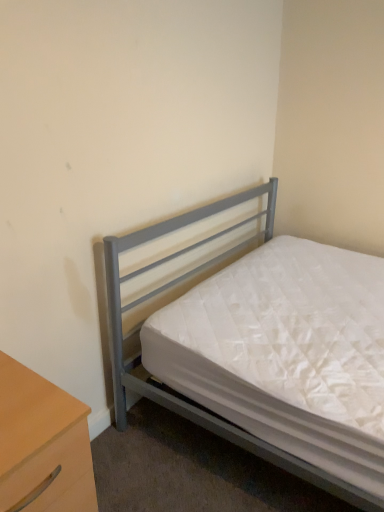
The width and height of the screenshot is (384, 512). Identify the location of metallic gray bed at center. (169, 392).

Measure the distance between metallic gray bed at center and camera.

A distance of 4.08 feet exists between metallic gray bed at center and camera.

The image size is (384, 512). What do you see at coordinates (169, 392) in the screenshot?
I see `metallic gray bed at center` at bounding box center [169, 392].

What do you see at coordinates (42, 444) in the screenshot? Image resolution: width=384 pixels, height=512 pixels. I see `light wood/wooden nightstand at lower left` at bounding box center [42, 444].

The height and width of the screenshot is (512, 384). Identify the location of light wood/wooden nightstand at lower left. (42, 444).

You are a GUI agent. You are given a task and a screenshot of the screen. Output one action in this format:
    pyautogui.click(x=<x>, y=<y>)
    Task: Click on the metallic gray bed at center
    
    Given the screenshot: What is the action you would take?
    pyautogui.click(x=169, y=392)

Between metallic gray bed at center and light wood/wooden nightstand at lower left, which one appears on the left side from the viewer's perspective?

Positioned to the left is light wood/wooden nightstand at lower left.

Which is in front, metallic gray bed at center or light wood/wooden nightstand at lower left?

Positioned in front is light wood/wooden nightstand at lower left.

Which point is more distant from viewer, (279, 450) or (46, 429)?

The point (279, 450) is farther from the camera.

From the image's perspective, is metallic gray bed at center below light wood/wooden nightstand at lower left?

No, from the image's perspective, metallic gray bed at center is not beneath light wood/wooden nightstand at lower left.

From a real-world perspective, between metallic gray bed at center and light wood/wooden nightstand at lower left, who is vertically lower?

light wood/wooden nightstand at lower left, from a real-world perspective.

Can you confirm if metallic gray bed at center is thinner than light wood/wooden nightstand at lower left?

No.

From the picture: From their relative heights in the image, would you say metallic gray bed at center is taller or shorter than light wood/wooden nightstand at lower left?

Clearly, metallic gray bed at center is taller compared to light wood/wooden nightstand at lower left.

Is metallic gray bed at center bigger or smaller than light wood/wooden nightstand at lower left?

Clearly, metallic gray bed at center is larger in size than light wood/wooden nightstand at lower left.

Is metallic gray bed at center completely or partially outside of light wood/wooden nightstand at lower left?

Yes, metallic gray bed at center is not within light wood/wooden nightstand at lower left.

Is metallic gray bed at center beside light wood/wooden nightstand at lower left?

metallic gray bed at center is not next to light wood/wooden nightstand at lower left, and they're not touching.

Is metallic gray bed at center facing towards light wood/wooden nightstand at lower left?

No, metallic gray bed at center does not turn towards light wood/wooden nightstand at lower left.

Looking at this image, how different are the orientations of metallic gray bed at center and light wood/wooden nightstand at lower left in degrees?

The angular difference between metallic gray bed at center and light wood/wooden nightstand at lower left is 1.87 degrees.

Measure the distance from metallic gray bed at center to light wood/wooden nightstand at lower left.

The distance of metallic gray bed at center from light wood/wooden nightstand at lower left is 28.23 inches.

You are a GUI agent. You are given a task and a screenshot of the screen. Output one action in this format:
    pyautogui.click(x=<x>, y=<y>)
    Task: Click on the bed behind the light wood/wooden nightstand at lower left
    The image size is (384, 512).
    Given the screenshot: What is the action you would take?
    pyautogui.click(x=169, y=392)

Would you say light wood/wooden nightstand at lower left is to the left or to the right of metallic gray bed at center in the picture?

light wood/wooden nightstand at lower left is to the left of metallic gray bed at center.

In the image, is light wood/wooden nightstand at lower left positioned in front of or behind metallic gray bed at center?

Visually, light wood/wooden nightstand at lower left is located in front of metallic gray bed at center.

Which point is more distant from viewer, (13, 392) or (181, 217)?

Positioned behind is point (181, 217).

From the image's perspective, is light wood/wooden nightstand at lower left over metallic gray bed at center?

No, from the image's perspective, light wood/wooden nightstand at lower left is not on top of metallic gray bed at center.

From a real-world perspective, is light wood/wooden nightstand at lower left located beneath metallic gray bed at center?

Yes, from a real-world perspective, light wood/wooden nightstand at lower left is below metallic gray bed at center.

Is light wood/wooden nightstand at lower left wider than metallic gray bed at center?

No.

Based on the photo, is light wood/wooden nightstand at lower left taller or shorter than metallic gray bed at center?

light wood/wooden nightstand at lower left is shorter than metallic gray bed at center.

Considering the relative sizes of light wood/wooden nightstand at lower left and metallic gray bed at center in the image provided, is light wood/wooden nightstand at lower left bigger than metallic gray bed at center?

Incorrect, light wood/wooden nightstand at lower left is not larger than metallic gray bed at center.

Is metallic gray bed at center located within light wood/wooden nightstand at lower left?

No, light wood/wooden nightstand at lower left does not contain metallic gray bed at center.

Consider the image. Is light wood/wooden nightstand at lower left next to metallic gray bed at center and touching it?

No, light wood/wooden nightstand at lower left is not with metallic gray bed at center.

Is light wood/wooden nightstand at lower left oriented towards metallic gray bed at center?

No, light wood/wooden nightstand at lower left is not facing towards metallic gray bed at center.

How different are the orientations of light wood/wooden nightstand at lower left and metallic gray bed at center in degrees?

They differ by 1.87 degrees in their facing directions.

How far apart are light wood/wooden nightstand at lower left and metallic gray bed at center?

light wood/wooden nightstand at lower left and metallic gray bed at center are 28.23 inches apart.

Image resolution: width=384 pixels, height=512 pixels. There is a light wood/wooden nightstand at lower left. What are the coordinates of `bed above it (from a real-world perspective)` in the screenshot? It's located at (169, 392).

Image resolution: width=384 pixels, height=512 pixels. Identify the location of nightstand below the metallic gray bed at center (from a real-world perspective). (42, 444).

The image size is (384, 512). What are the coordinates of `bed above the light wood/wooden nightstand at lower left (from the image's perspective)` in the screenshot? It's located at (169, 392).